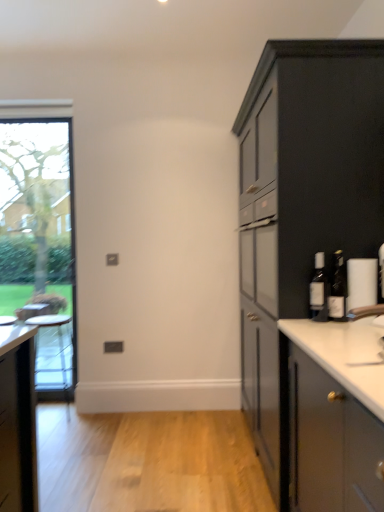
Question: Could matte glass bottle at right, the second bottle when ordered from left to right, be considered to be inside clear glass window at left?

Choices:
 (A) yes
 (B) no

Answer: (B)

Question: From the image's perspective, would you say clear glass window at left is shown under matte glass bottle at right, marked as the 1th bottle in a right-to-left arrangement?

Choices:
 (A) yes
 (B) no

Answer: (B)

Question: Is clear glass window at left bigger than matte glass bottle at right, the second bottle when ordered from left to right?

Choices:
 (A) yes
 (B) no

Answer: (A)

Question: Does clear glass window at left have a smaller size compared to matte glass bottle at right, the second bottle when ordered from left to right?

Choices:
 (A) yes
 (B) no

Answer: (B)

Question: Is there a large distance between clear glass window at left and matte glass bottle at right, the second bottle when ordered from left to right?

Choices:
 (A) no
 (B) yes

Answer: (B)

Question: Considering the relative sizes of clear glass window at left and matte glass bottle at right, the second bottle when ordered from left to right, in the image provided, is clear glass window at left wider than matte glass bottle at right, the second bottle when ordered from left to right,?

Choices:
 (A) yes
 (B) no

Answer: (A)

Question: Is translucent glass bottle at right, the second bottle viewed from the right, facing towards clear glass window at left?

Choices:
 (A) no
 (B) yes

Answer: (A)

Question: Would you say clear glass window at left is part of translucent glass bottle at right, which is the first bottle from left to right,'s contents?

Choices:
 (A) no
 (B) yes

Answer: (A)

Question: From a real-world perspective, is translucent glass bottle at right, which is the first bottle from left to right, under clear glass window at left?

Choices:
 (A) yes
 (B) no

Answer: (A)

Question: Is translucent glass bottle at right, the second bottle viewed from the right, behind clear glass window at left?

Choices:
 (A) yes
 (B) no

Answer: (B)

Question: Is translucent glass bottle at right, which is the first bottle from left to right, smaller than clear glass window at left?

Choices:
 (A) yes
 (B) no

Answer: (A)

Question: From the image's perspective, is translucent glass bottle at right, which is the first bottle from left to right, located above clear glass window at left?

Choices:
 (A) no
 (B) yes

Answer: (A)

Question: Can you confirm if matte gray cabinet at right is bigger than matte glass bottle at right, the second bottle when ordered from left to right?

Choices:
 (A) no
 (B) yes

Answer: (B)